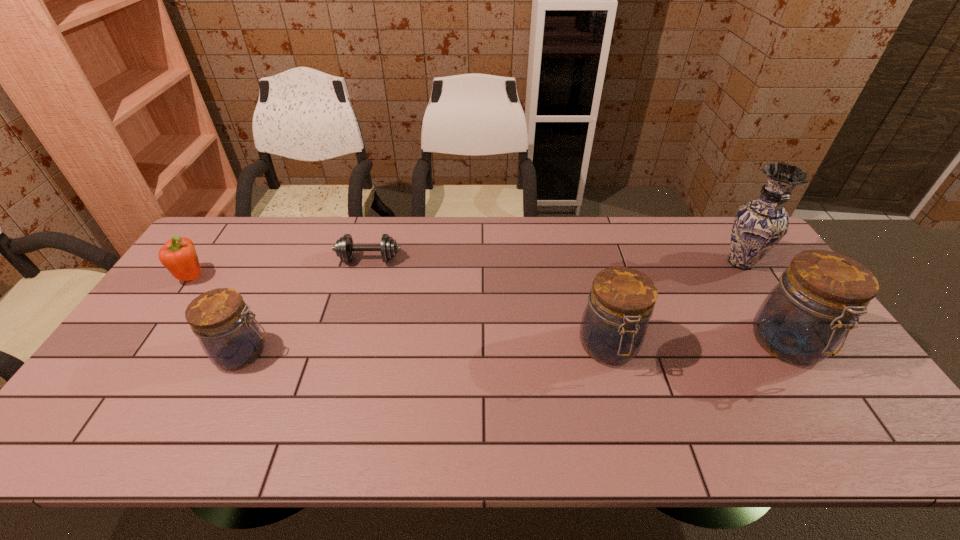
Identify the location of vacant space that's between the leftmost jar and the second jar from right to left. (426, 350).

You are a GUI agent. You are given a task and a screenshot of the screen. Output one action in this format:
    pyautogui.click(x=<x>, y=<y>)
    Task: Click on the free space between the leftmost jar and the vase
    This screenshot has height=540, width=960.
    Given the screenshot: What is the action you would take?
    pyautogui.click(x=492, y=307)

Where is `free point between the second jar from left to right and the rightmost jar`? free point between the second jar from left to right and the rightmost jar is located at coordinates (698, 346).

You are a GUI agent. You are given a task and a screenshot of the screen. Output one action in this format:
    pyautogui.click(x=<x>, y=<y>)
    Task: Click on the free area in between the leftmost jar and the shortest object
    
    Given the screenshot: What is the action you would take?
    pyautogui.click(x=306, y=306)

Image resolution: width=960 pixels, height=540 pixels. I want to click on object that is the fourth closest to the tallest object, so click(x=231, y=337).

Where is `object that is the fourth closest to the fourth object from left to right`? This screenshot has width=960, height=540. object that is the fourth closest to the fourth object from left to right is located at coordinates (231, 337).

Select which jar is the closest to the leftmost object. Please provide its 2D coordinates. Your answer should be formatted as a tuple, i.e. [(x, y)], where the tuple contains the x and y coordinates of a point satisfying the conditions above.

[(231, 337)]

Locate an element on the screen. jar object that ranks as the closest to the fourth object from right to left is located at coordinates (231, 337).

Where is `free spot that satisfies the following two spatial constraints: 1. on the front side of the shortest object; 2. on the left side of the tallest object`? free spot that satisfies the following two spatial constraints: 1. on the front side of the shortest object; 2. on the left side of the tallest object is located at coordinates (369, 262).

Identify the location of vacant space that satisfies the following two spatial constraints: 1. on the lid of the rightmost jar; 2. on the lid of the fifth object from right to left. The width and height of the screenshot is (960, 540). (794, 353).